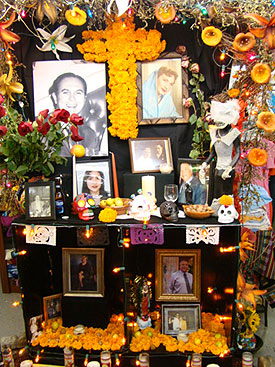
Find the location of a particular element. string of lights vertical is located at coordinates tap(119, 269).